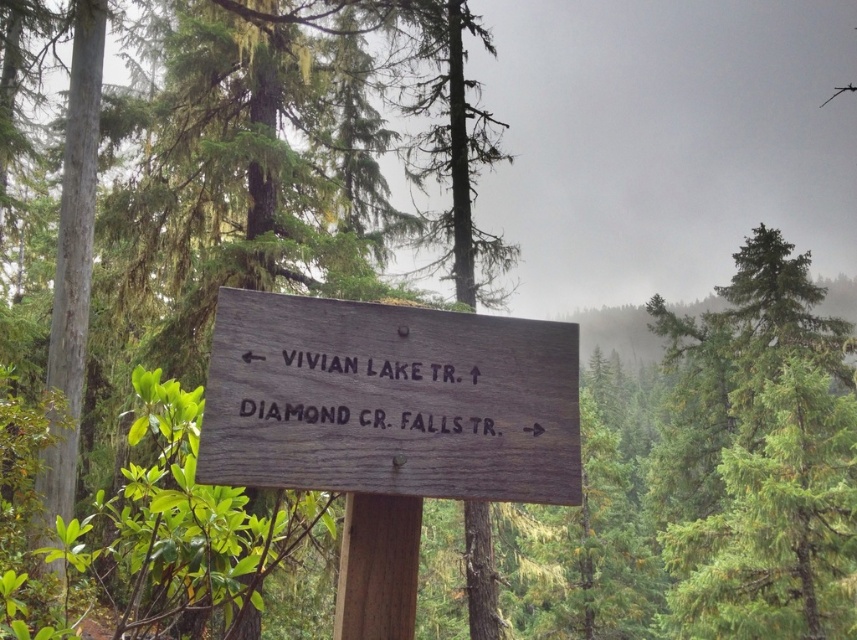
Question: Which point is farther to the camera?

Choices:
 (A) green wood sign at center
 (B) brown wooden post at center

Answer: (A)

Question: Is green wood sign at center to the left of weathered wood sign at center from the viewer's perspective?

Choices:
 (A) no
 (B) yes

Answer: (A)

Question: Does green wood sign at center have a smaller size compared to weathered wood sign at center?

Choices:
 (A) yes
 (B) no

Answer: (A)

Question: Can you confirm if green wood sign at center is positioned below weathered wood sign at center?

Choices:
 (A) yes
 (B) no

Answer: (B)

Question: Which point appears farthest from the camera in this image?

Choices:
 (A) (519, 476)
 (B) (369, 276)
 (C) (351, 506)

Answer: (B)

Question: Which object is closer to the camera taking this photo?

Choices:
 (A) green wood sign at center
 (B) weathered wood sign at center

Answer: (B)